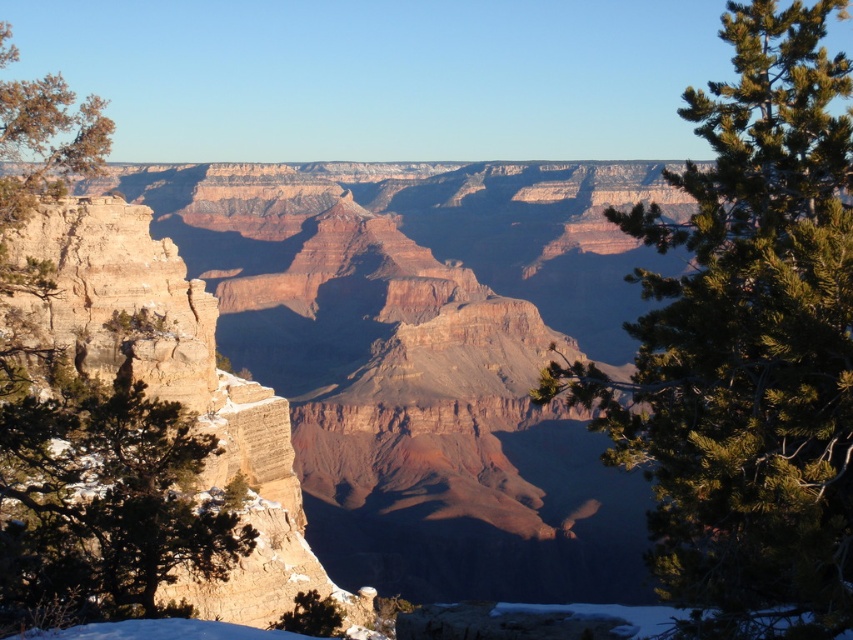
From the picture: Who is more distant from viewer, [660,426] or [148,561]?

Point [148,561]

Measure the distance from green needle-like tree at right to green textured tree at left.

green needle-like tree at right and green textured tree at left are 12.61 meters apart.

Locate an element on the screen. Image resolution: width=853 pixels, height=640 pixels. green needle-like tree at right is located at coordinates (747, 346).